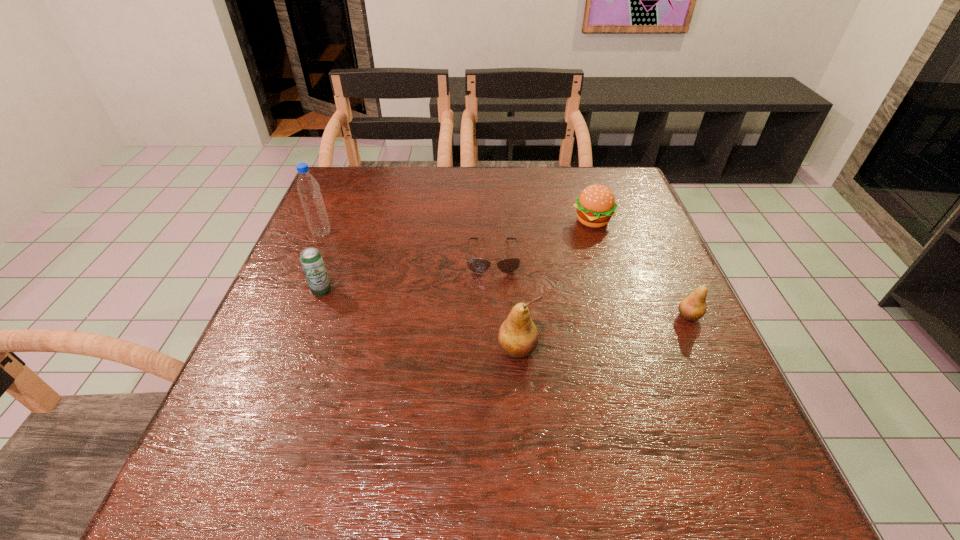
The pears are evenly distributed in the image. To maintain this, where would you place another pear on the left? Please point to a free space. Please provide its 2D coordinates. Your answer should be formatted as a tuple, i.e. [(x, y)], where the tuple contains the x and y coordinates of a point satisfying the conditions above.

[(319, 387)]